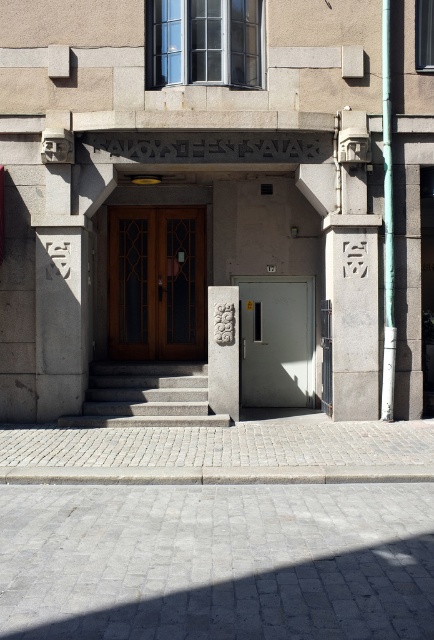
Question: From the image, what is the correct spatial relationship of gray metallic door at center in relation to gray concrete stairs at center?

Choices:
 (A) right
 (B) left

Answer: (A)

Question: Is gray concrete pillar at center further to the viewer compared to gray metallic door at center?

Choices:
 (A) yes
 (B) no

Answer: (B)

Question: Which of the following is the farthest from the observer?

Choices:
 (A) wooden glass-paneled door at center
 (B) gray metallic door at center
 (C) gray cobblestone pavement at lower center

Answer: (A)

Question: Which point is closer to the camera taking this photo?

Choices:
 (A) (134, 227)
 (B) (352, 368)
 (C) (223, 326)
 (D) (164, 380)

Answer: (B)

Question: Which point is farther from the camera taking this photo?

Choices:
 (A) (371, 344)
 (B) (266, 339)

Answer: (B)

Question: Does wooden glass-paneled door at center have a lesser width compared to carved stone column at center?

Choices:
 (A) no
 (B) yes

Answer: (A)